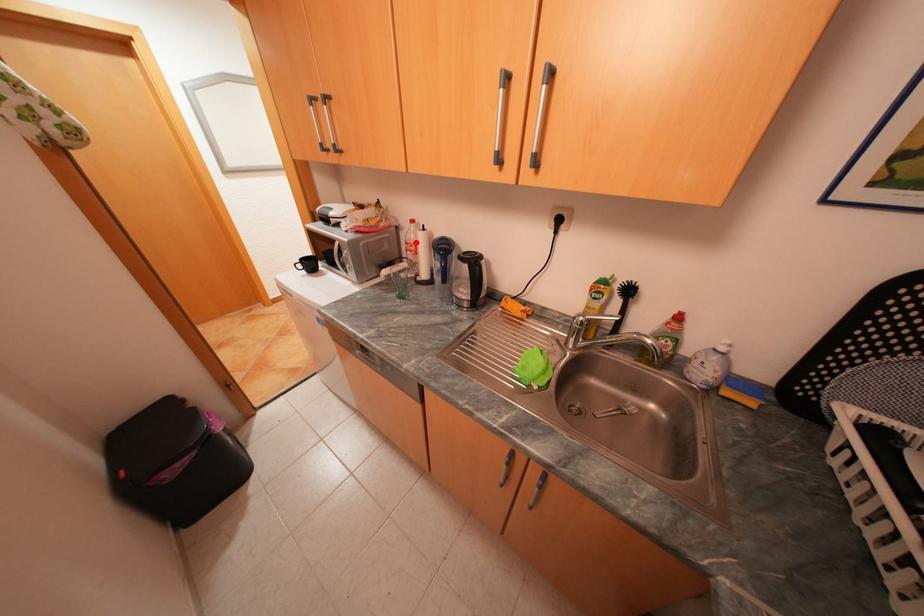
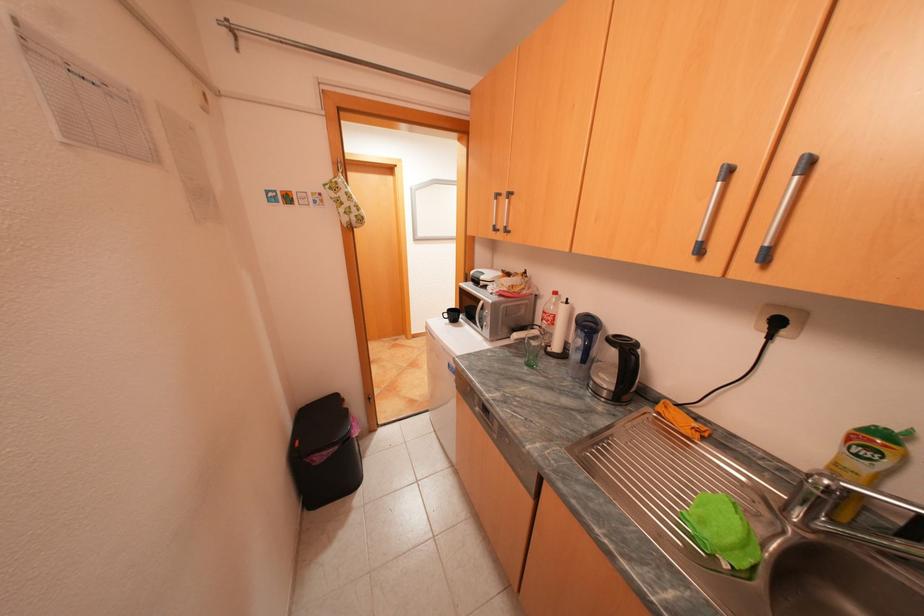
Where in the second image is the point corresponding to the highlighted location from the first image?

(553, 312)